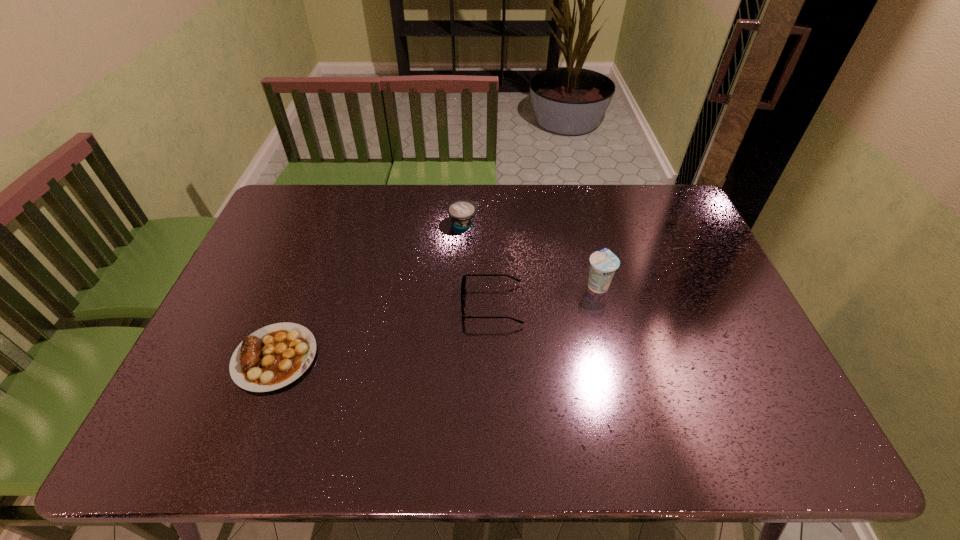
At what (x,y) coordinates should I click in order to perform the action: click on vacant space in between the farther yogurt and the shortest object. Please return your answer as a coordinate pair (x, y). This screenshot has height=540, width=960. Looking at the image, I should click on (370, 290).

Identify which object is the closest to the spectacles. Please provide its 2D coordinates. Your answer should be formatted as a tuple, i.e. [(x, y)], where the tuple contains the x and y coordinates of a point satisfying the conditions above.

[(604, 263)]

In order to click on object that is the second closest one to the farther yogurt in this screenshot , I will do `click(604, 263)`.

The image size is (960, 540). In order to click on free space that satisfies the following two spatial constraints: 1. on the front side of the left yogurt; 2. on the right side of the tallest object in this screenshot , I will do `click(461, 285)`.